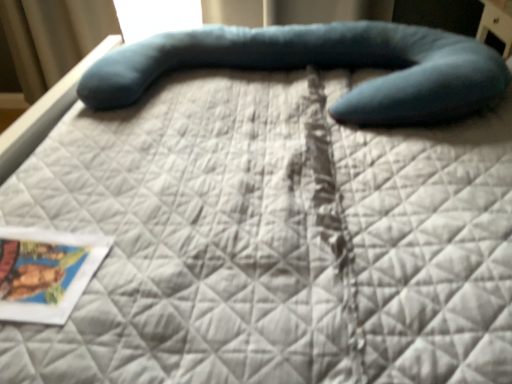
You are a GUI agent. You are given a task and a screenshot of the screen. Output one action in this format:
    pyautogui.click(x=<x>, y=<y>)
    Task: Click on the blank space situated above matte paper postcard at lower left (from a real-world perspective)
    The image size is (512, 384).
    Given the screenshot: What is the action you would take?
    pyautogui.click(x=36, y=259)